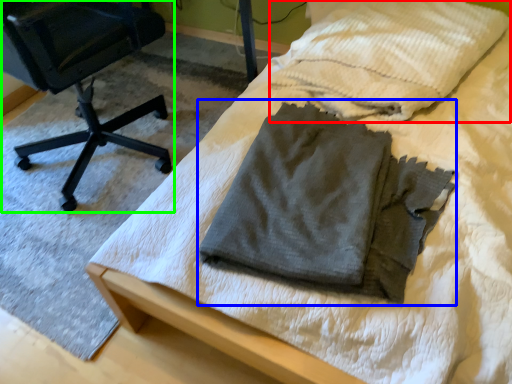
Question: Considering the real-world distances, which object is closest to cloth (highlighted by a red box)? laundry (highlighted by a blue box) or chair (highlighted by a green box).

Choices:
 (A) laundry
 (B) chair

Answer: (A)